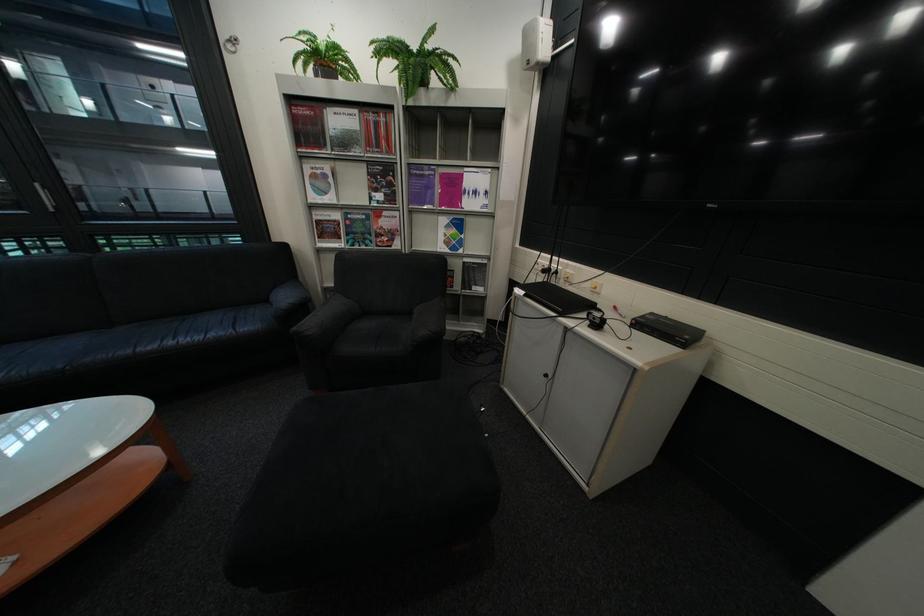
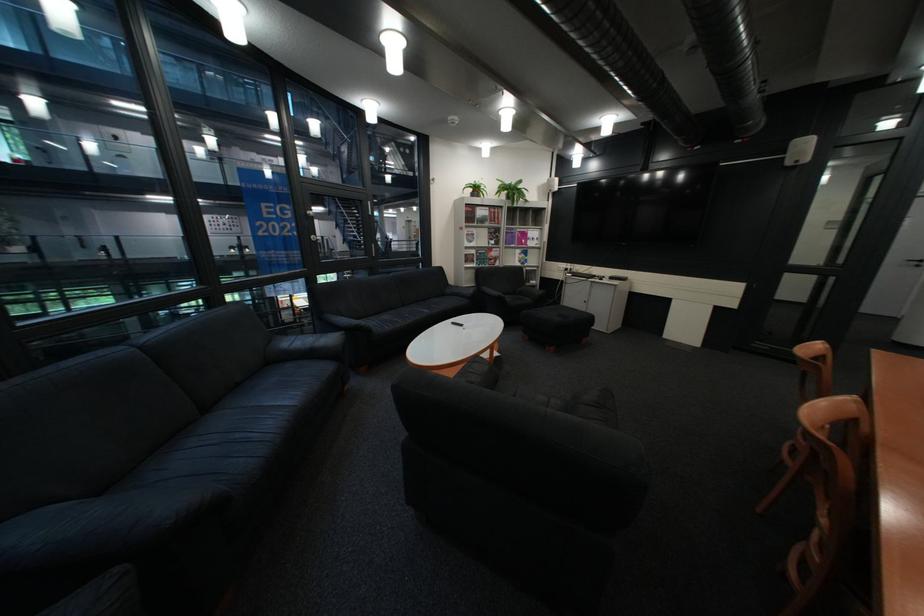
Locate, in the second image, the point that corresponds to [385,175] in the first image.

(505, 233)